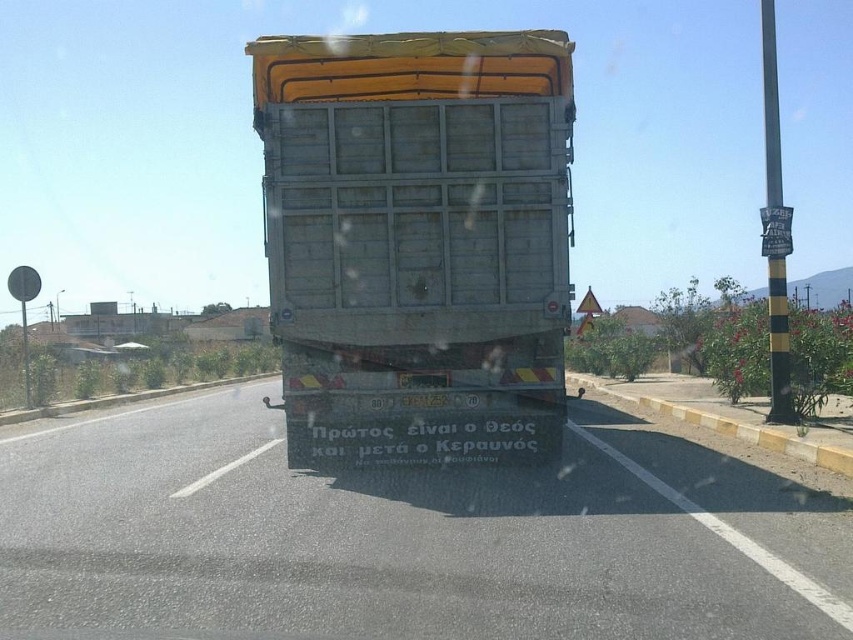
Question: Which object appears farthest from the camera in this image?

Choices:
 (A) metallic truck at center
 (B) rusty metal trailer truck at center

Answer: (B)

Question: In this image, where is metallic truck at center located relative to rusty metal trailer truck at center?

Choices:
 (A) below
 (B) above

Answer: (A)

Question: Is metallic truck at center further to camera compared to rusty metal trailer truck at center?

Choices:
 (A) no
 (B) yes

Answer: (A)

Question: Among these points, which one is farthest from the camera?

Choices:
 (A) (187, 440)
 (B) (527, 129)

Answer: (A)

Question: Can you confirm if metallic truck at center is positioned to the left of rusty metal trailer truck at center?

Choices:
 (A) yes
 (B) no

Answer: (B)